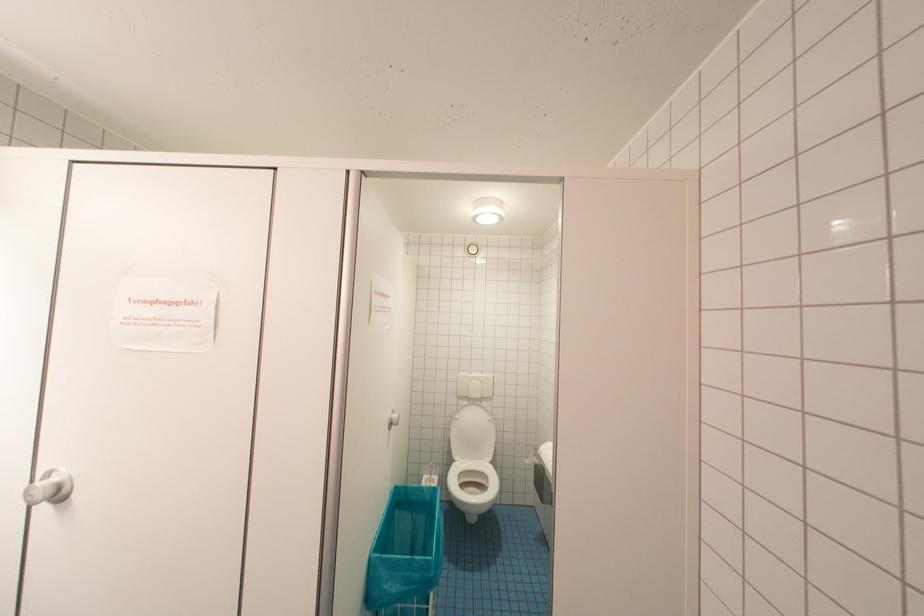
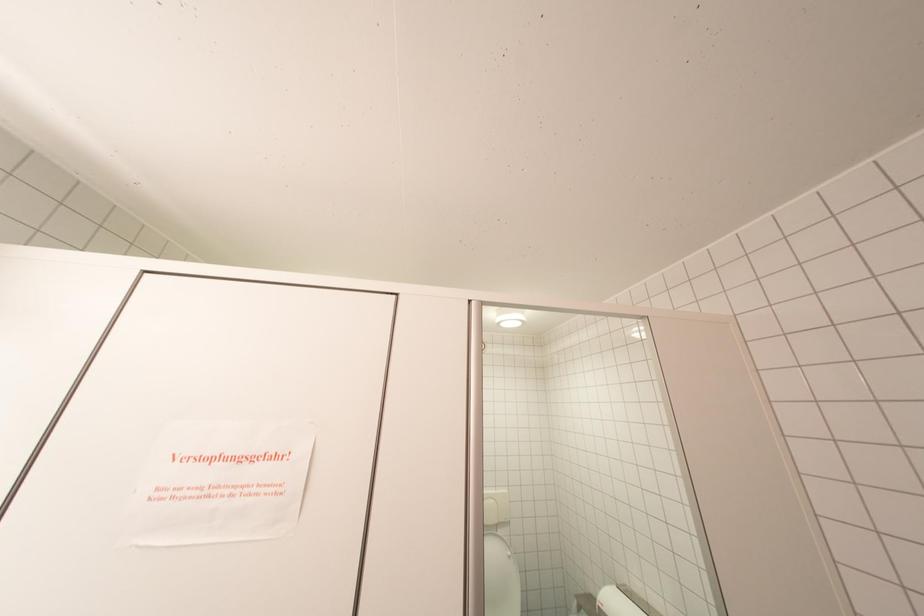
Question: What movement of the cameraman would produce the second image?

Choices:
 (A) Left
 (B) Right
 (C) Forward
 (D) Backward

Answer: (A)